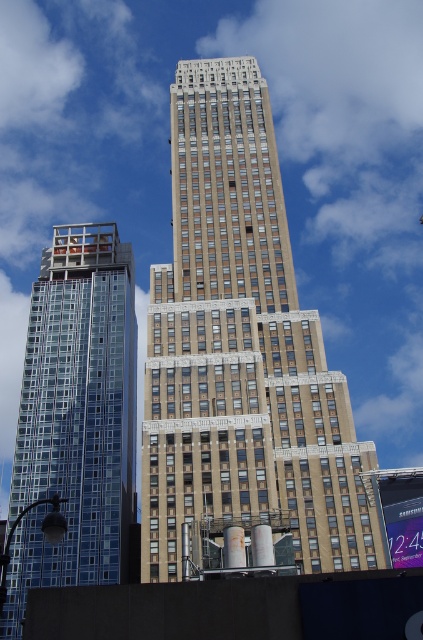
Question: In this image, where is brown stone building at center located relative to glassy blue skyscraper at left?

Choices:
 (A) right
 (B) left

Answer: (A)

Question: Which point is closer to the camera taking this photo?

Choices:
 (A) (107, 449)
 (B) (186, 292)

Answer: (A)

Question: From the image, what is the correct spatial relationship of brown stone building at center in relation to glassy blue skyscraper at left?

Choices:
 (A) left
 (B) right

Answer: (B)

Question: Does brown stone building at center have a lesser width compared to glassy blue skyscraper at left?

Choices:
 (A) yes
 (B) no

Answer: (B)